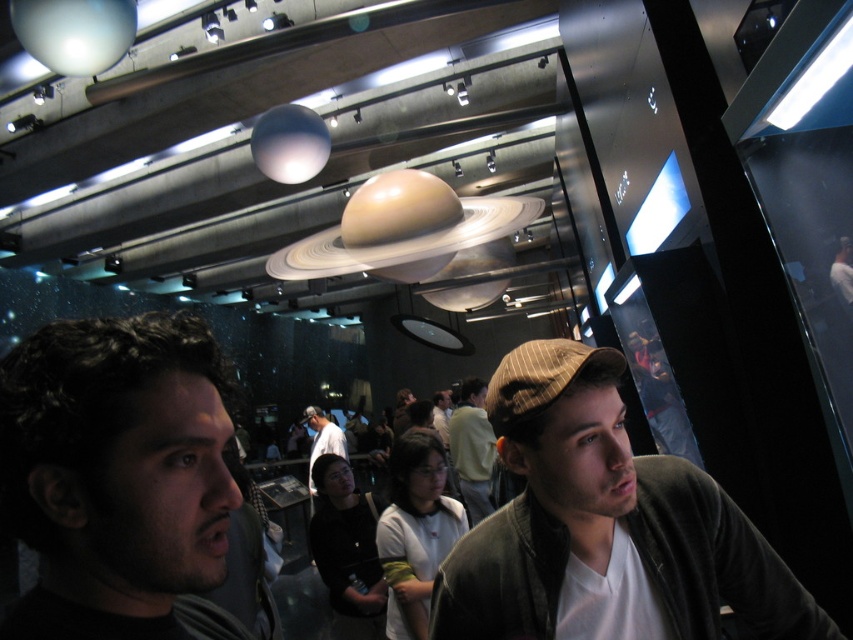
Can you confirm if dark brown hair at center is positioned above white shirt at center?

Yes.

Between dark brown hair at center and white shirt at center, which one has more height?

white shirt at center

The image size is (853, 640). I want to click on dark brown hair at center, so click(115, 474).

The image size is (853, 640). What are the coordinates of `dark brown hair at center` in the screenshot? It's located at (115, 474).

Is dark brown hair at center shorter than brown striped hat at center?

Indeed, dark brown hair at center has a lesser height compared to brown striped hat at center.

Between point (44, 518) and point (479, 410), which one is positioned behind?

Point (479, 410)

This screenshot has height=640, width=853. Identify the location of dark brown hair at center. (115, 474).

Is brown striped hat at center below white shirt at center?

Actually, brown striped hat at center is above white shirt at center.

Who is more distant from viewer, (x=489, y=458) or (x=310, y=445)?

Positioned behind is point (x=310, y=445).

Who is more forward, (476, 518) or (312, 461)?

Point (312, 461)

Where is `brown striped hat at center`? The height and width of the screenshot is (640, 853). brown striped hat at center is located at coordinates (473, 449).